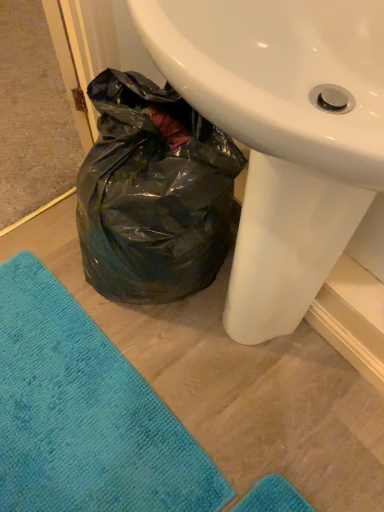
The width and height of the screenshot is (384, 512). What are the coordinates of `free space to the right of teal soft towel at lower left` in the screenshot? It's located at (239, 390).